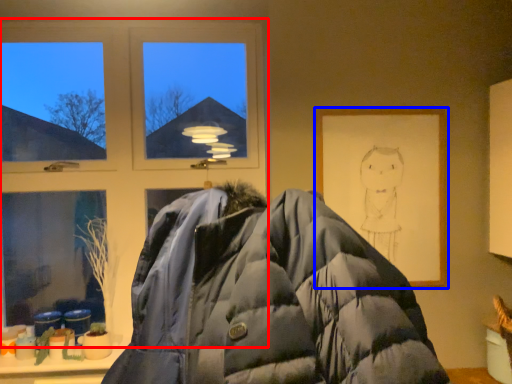
Question: Which object appears farthest to the camera in this image, window (highlighted by a red box) or picture frame (highlighted by a blue box)?

Choices:
 (A) window
 (B) picture frame

Answer: (A)